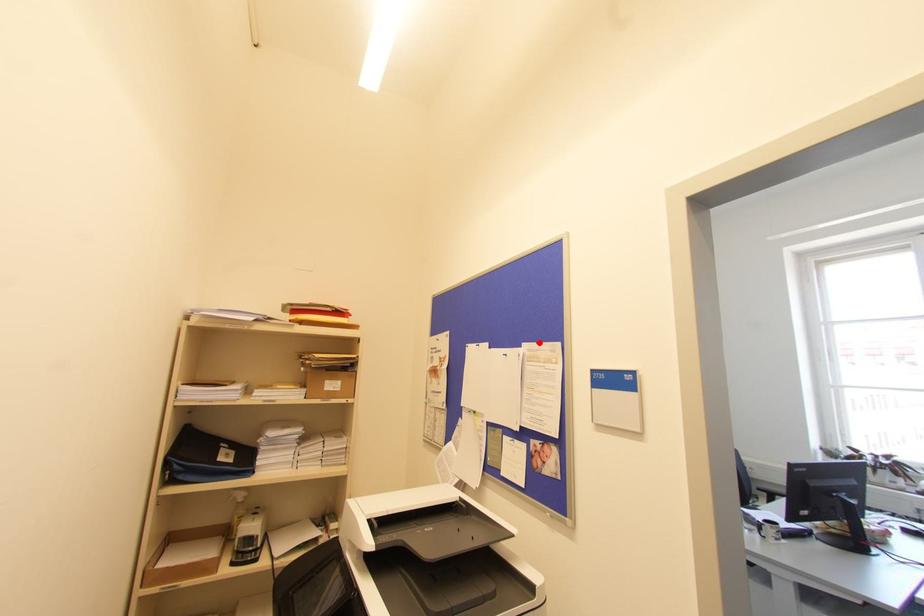
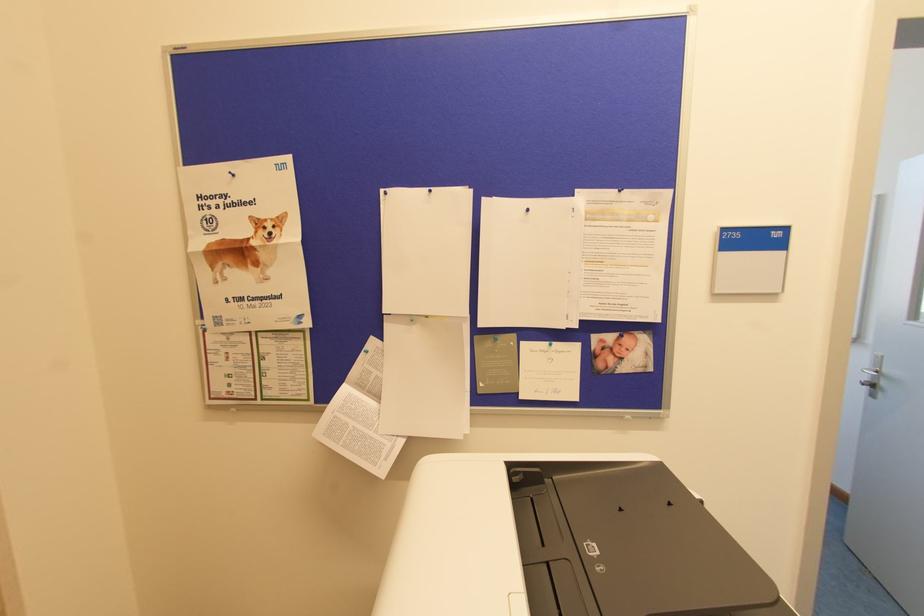
The point at the highlighted location is marked in the first image. Where is the corresponding point in the second image?

(619, 190)